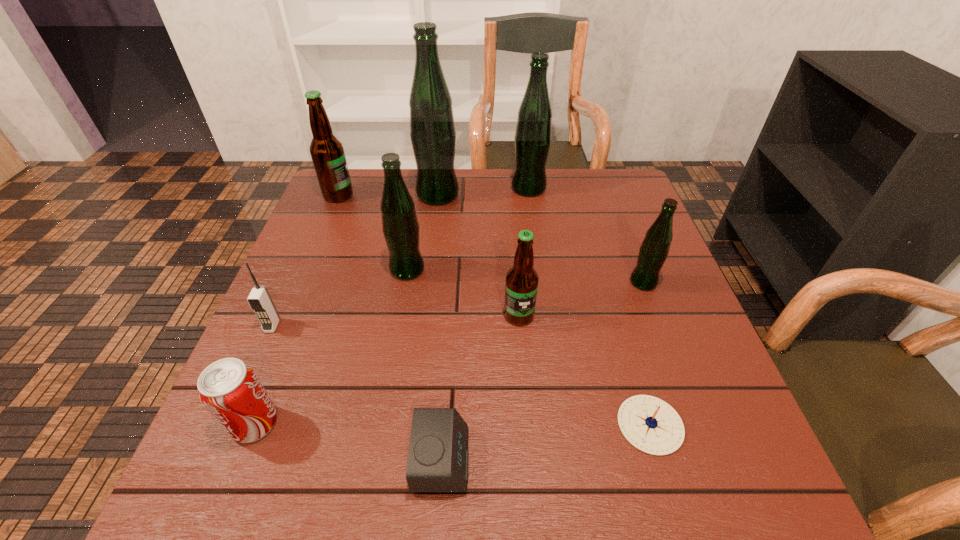
Locate an element on the screen. The image size is (960, 540). vacant space at the far right corner of the desktop is located at coordinates pos(642,207).

I want to click on free space at the near right corner of the desktop, so click(704, 482).

The height and width of the screenshot is (540, 960). Find the location of `free space that is in between the soda can and the nearest beer bottle`. free space that is in between the soda can and the nearest beer bottle is located at coordinates (387, 369).

What are the coordinates of `unoccupied area between the red soda can and the bigger brown beer bottle` in the screenshot? It's located at (297, 309).

Find the location of a particular element. The width and height of the screenshot is (960, 540). free space between the nearer brown beer bottle and the shortest object is located at coordinates (585, 370).

Where is `free space between the tallest object and the cellular telephone`? Image resolution: width=960 pixels, height=540 pixels. free space between the tallest object and the cellular telephone is located at coordinates (355, 260).

Locate an element on the screen. This screenshot has width=960, height=540. empty space that is in between the nearest beer bottle and the ninth tallest object is located at coordinates (480, 388).

Locate an element on the screen. This screenshot has height=540, width=960. empty space that is in between the ninth tallest object and the second biggest green beer bottle is located at coordinates (485, 324).

In order to click on vacant region between the smaller brown beer bottle and the red soda can in this screenshot , I will do `click(387, 369)`.

I want to click on free space between the blue compass and the rightmost beer bottle, so (x=646, y=354).